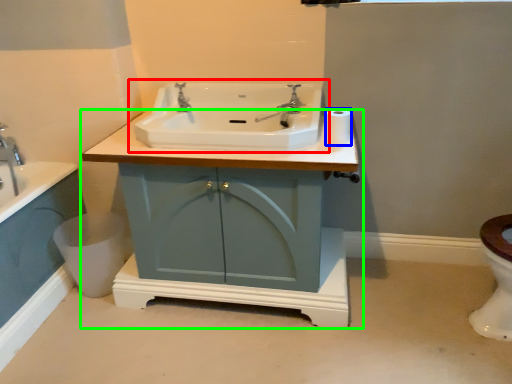
Question: Which object is the farthest from sink (highlighted by a red box)? Choose among these: toilet paper (highlighted by a blue box) or bathroom cabinet (highlighted by a green box).

Choices:
 (A) toilet paper
 (B) bathroom cabinet

Answer: (B)